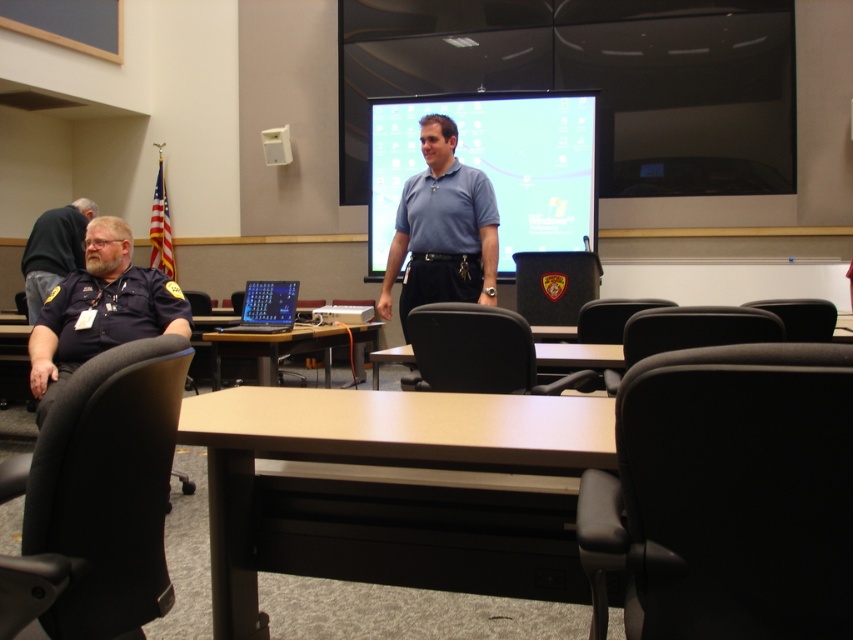
Can you confirm if matte black uniform at left is taller than white plastic projector at center?

Correct, matte black uniform at left is much taller as white plastic projector at center.

Who is higher up, matte black uniform at left or white plastic projector at center?

white plastic projector at center is above.

Find the location of a particular element. This screenshot has width=853, height=640. matte black uniform at left is located at coordinates (100, 308).

Can you confirm if dark blue uniform at left is shorter than black leather chair at right?

No, dark blue uniform at left is not shorter than black leather chair at right.

Is point (78, 266) closer to camera compared to point (801, 307)?

No, it is not.

You are a GUI agent. You are given a task and a screenshot of the screen. Output one action in this format:
    pyautogui.click(x=<x>, y=<y>)
    Task: Click on the dark blue uniform at left
    This screenshot has height=640, width=853.
    Given the screenshot: What is the action you would take?
    pyautogui.click(x=53, y=250)

The width and height of the screenshot is (853, 640). What do you see at coordinates (99, 499) in the screenshot? I see `black fabric swivel chair at left` at bounding box center [99, 499].

Who is positioned more to the right, black fabric swivel chair at left or black leather chair at right?

Positioned to the right is black leather chair at right.

The image size is (853, 640). What are the coordinates of `black fabric swivel chair at left` in the screenshot? It's located at (99, 499).